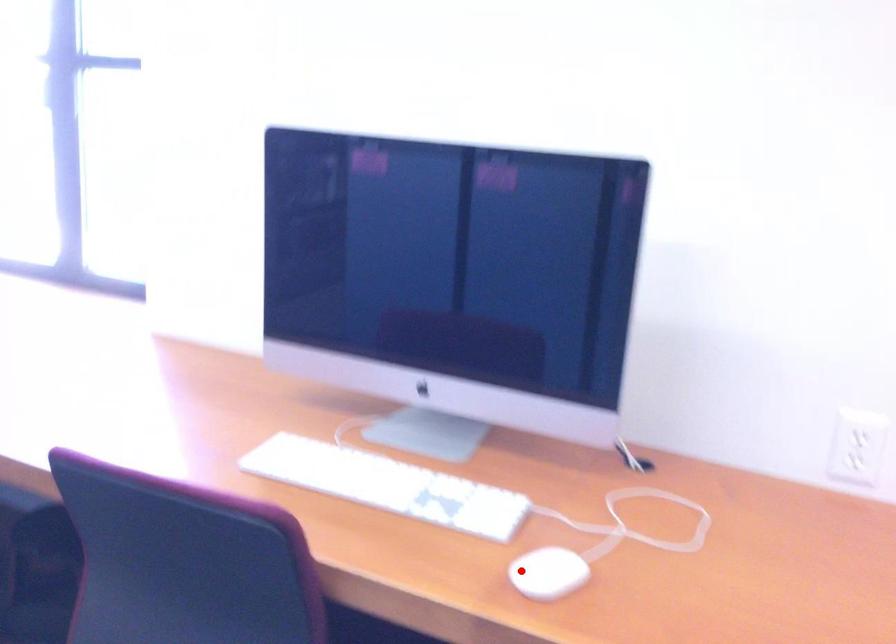
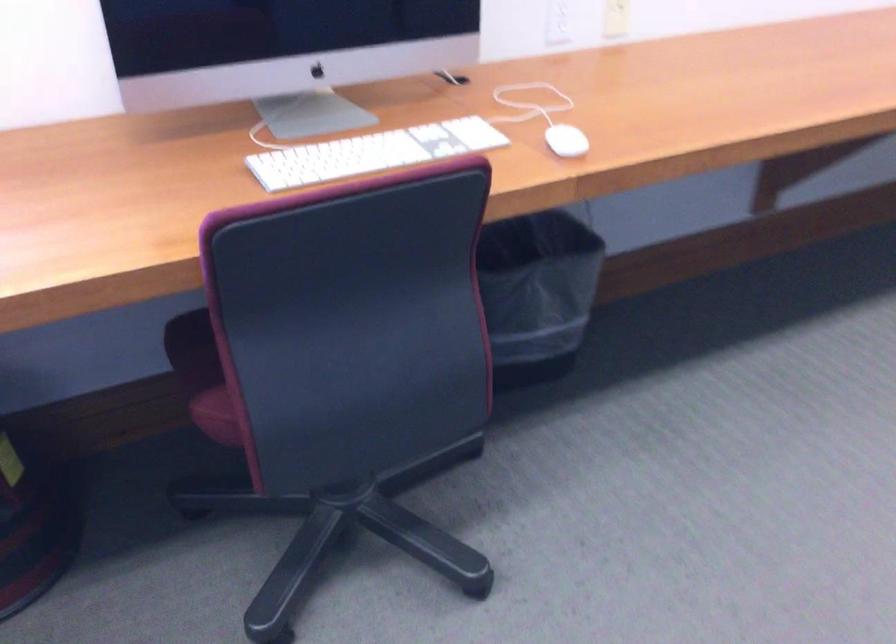
Question: I am providing you with two images of the same scene from different viewpoints. Given a red point in image1, look at the same physical point in image2. Is it:

Choices:
 (A) Closer to the viewpoint
 (B) Farther from the viewpoint

Answer: (B)